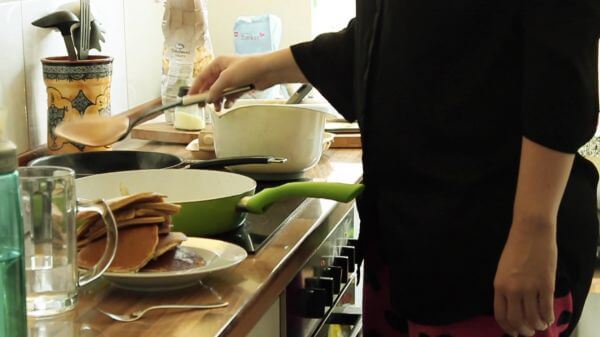
Where is `dish`? dish is located at coordinates point(227,255).